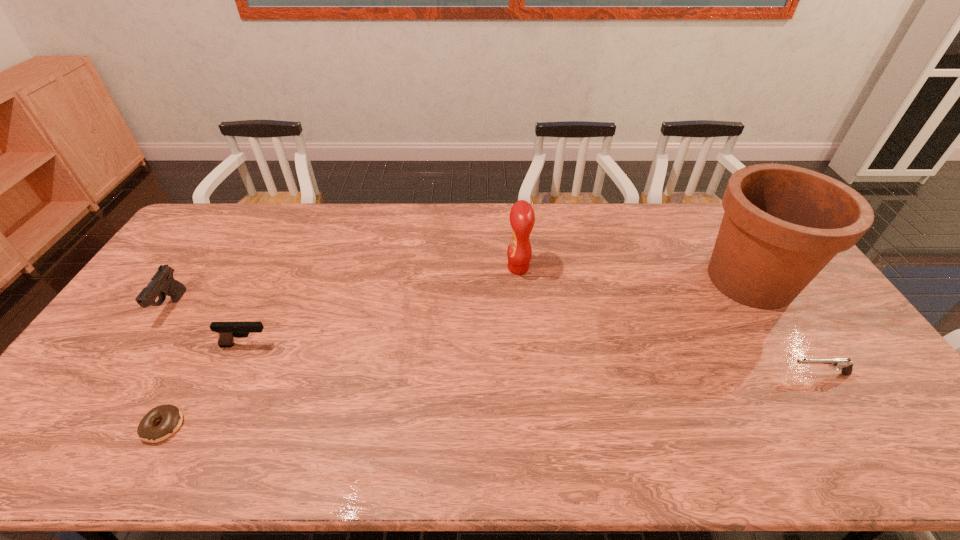
At what (x,y) coordinates should I click in order to perform the action: click on the tallest object. Please return your answer as a coordinate pair (x, y). Looking at the image, I should click on (782, 224).

I want to click on the third object from right to left, so click(x=522, y=218).

You are a GUI agent. You are given a task and a screenshot of the screen. Output one action in this format:
    pyautogui.click(x=<x>, y=<y>)
    Task: Click on the fifth shortest object
    This screenshot has height=540, width=960.
    Given the screenshot: What is the action you would take?
    pyautogui.click(x=522, y=218)

Locate an element on the screen. The image size is (960, 540). the leftmost object is located at coordinates (162, 283).

You are a GUI agent. You are given a task and a screenshot of the screen. Output one action in this format:
    pyautogui.click(x=<x>, y=<y>)
    Task: Click on the third tallest object
    This screenshot has width=960, height=540.
    Given the screenshot: What is the action you would take?
    pyautogui.click(x=162, y=283)

Locate an element on the screen. This screenshot has width=960, height=540. the fourth tallest object is located at coordinates (227, 331).

Image resolution: width=960 pixels, height=540 pixels. I want to click on the second pistol from right to left, so click(x=227, y=331).

This screenshot has height=540, width=960. I want to click on the fifth farthest object, so click(842, 364).

Find the location of a particular element. The height and width of the screenshot is (540, 960). the rightmost pistol is located at coordinates (842, 364).

You are a GUI agent. You are given a task and a screenshot of the screen. Output one action in this format:
    pyautogui.click(x=<x>, y=<y>)
    Task: Click on the shortest object
    
    Given the screenshot: What is the action you would take?
    pyautogui.click(x=171, y=417)